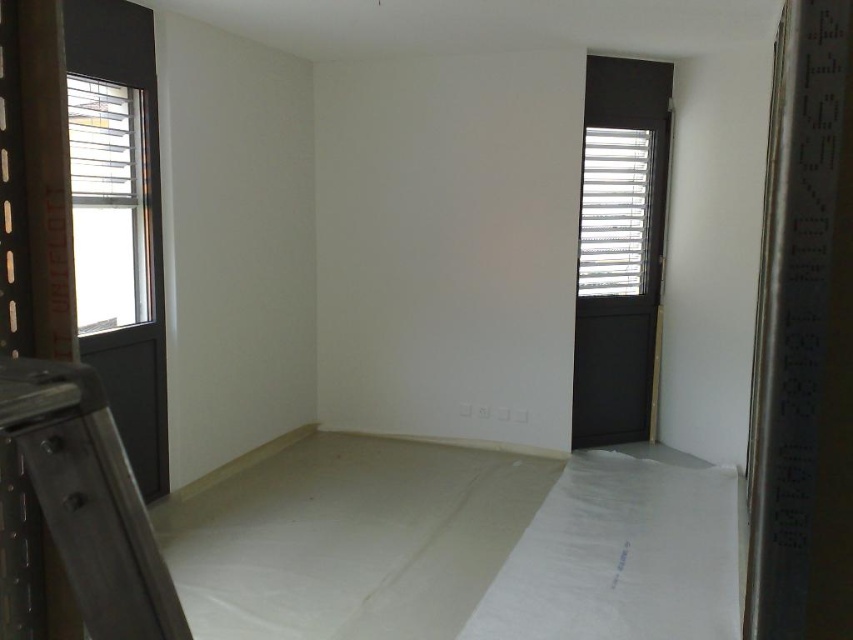
Question: Which of the following is the farthest from the observer?

Choices:
 (A) white textured blinds at upper right
 (B) metallic black ladder at lower left
 (C) clear glass window at left
 (D) matte black door at right

Answer: (A)

Question: Among these points, which one is nearest to the camera?

Choices:
 (A) (94, 477)
 (B) (604, 420)
 (C) (602, 156)

Answer: (A)

Question: Is matte black door at right behind white textured blinds at upper right?

Choices:
 (A) no
 (B) yes

Answer: (A)

Question: Is matte black door at right smaller than white textured blinds at upper right?

Choices:
 (A) yes
 (B) no

Answer: (B)

Question: Which of the following is the farthest from the observer?

Choices:
 (A) matte black door at right
 (B) white textured blinds at upper right
 (C) metallic black ladder at lower left

Answer: (B)

Question: Where is metallic black ladder at lower left located in relation to clear glass window at left in the image?

Choices:
 (A) below
 (B) above

Answer: (A)